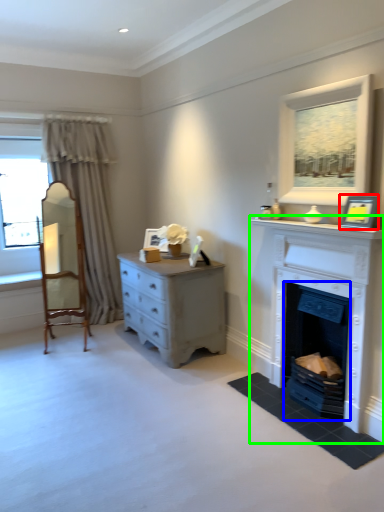
Question: Which object is the farthest from picture frame (highlighted by a red box)? Choose among these: fireplace (highlighted by a blue box) or fireplace (highlighted by a green box).

Choices:
 (A) fireplace
 (B) fireplace

Answer: (A)